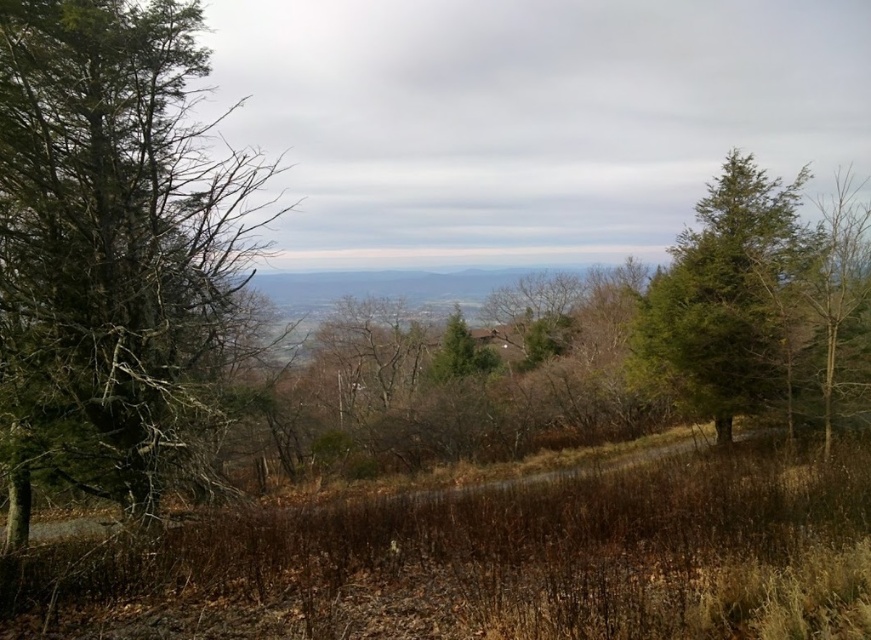
Is point (788, 211) in front of point (827, 424)?

No, (788, 211) is behind (827, 424).

Where is `green needle-like tree at right`? The height and width of the screenshot is (640, 871). green needle-like tree at right is located at coordinates (726, 298).

Does green matte tree at left have a greater width compared to green matte tree at right?

In fact, green matte tree at left might be narrower than green matte tree at right.

Is point (73, 60) behind point (839, 214)?

No, it is in front of (839, 214).

Does point (129, 266) lie behind point (868, 204)?

No, (129, 266) is in front of (868, 204).

Locate an element on the screen. green matte tree at left is located at coordinates (107, 241).

Looking at this image, between green matte tree at left and green needle-like tree at right, which one has less height?

green matte tree at left is shorter.

Does green matte tree at left appear over green needle-like tree at right?

Incorrect, green matte tree at left is not positioned above green needle-like tree at right.

Find the location of a particular element. green matte tree at left is located at coordinates (107, 241).